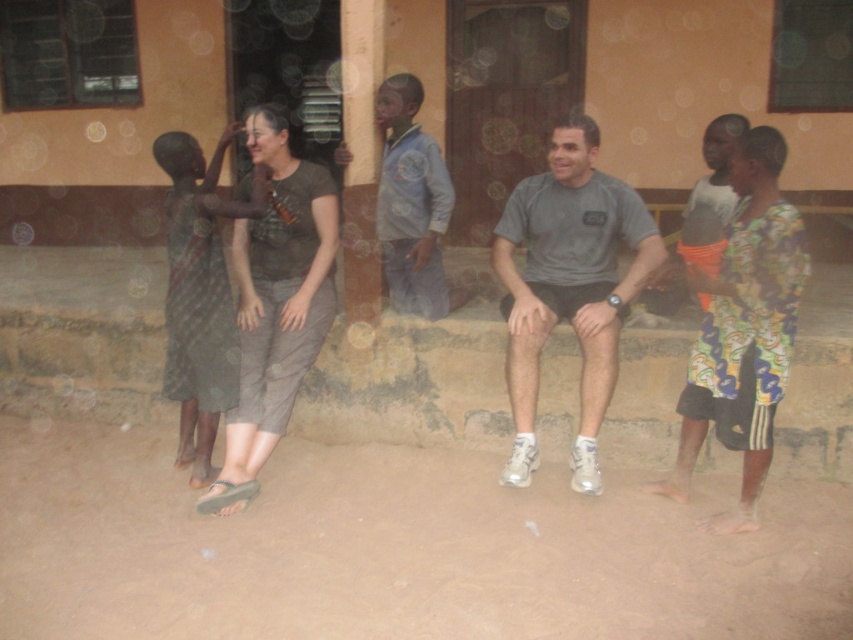
Question: Estimate the real-world distances between objects in this image. Which object is farther from the brown cotton shirt at center?

Choices:
 (A) gray matte t-shirt at center
 (B) dark gray fabric dress at left
 (C) printed fabric dress at right

Answer: (C)

Question: Is printed fabric dress at right behind brown cotton shirt at center?

Choices:
 (A) yes
 (B) no

Answer: (B)

Question: Is gray matte t-shirt at center smaller than dark gray fabric dress at left?

Choices:
 (A) yes
 (B) no

Answer: (A)

Question: Which point is closer to the camera?

Choices:
 (A) (267, 378)
 (B) (523, 224)
 (C) (769, 212)
 (D) (196, 316)

Answer: (C)

Question: Does gray matte t-shirt at center appear on the right side of brown cotton shirt at center?

Choices:
 (A) no
 (B) yes

Answer: (B)

Question: Among these points, which one is farthest from the camera?

Choices:
 (A) (187, 388)
 (B) (242, 380)
 (C) (502, 230)

Answer: (A)